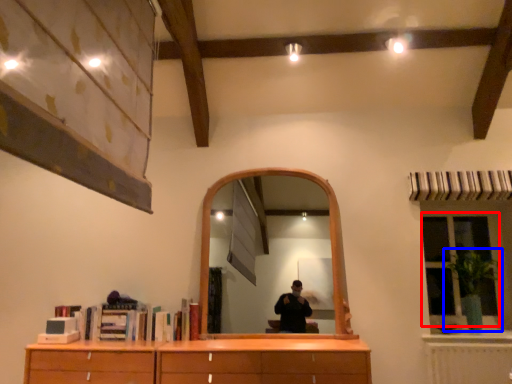
Question: Among these objects, which one is farthest to the camera, window (highlighted by a red box) or plant (highlighted by a blue box)?

Choices:
 (A) window
 (B) plant

Answer: (A)